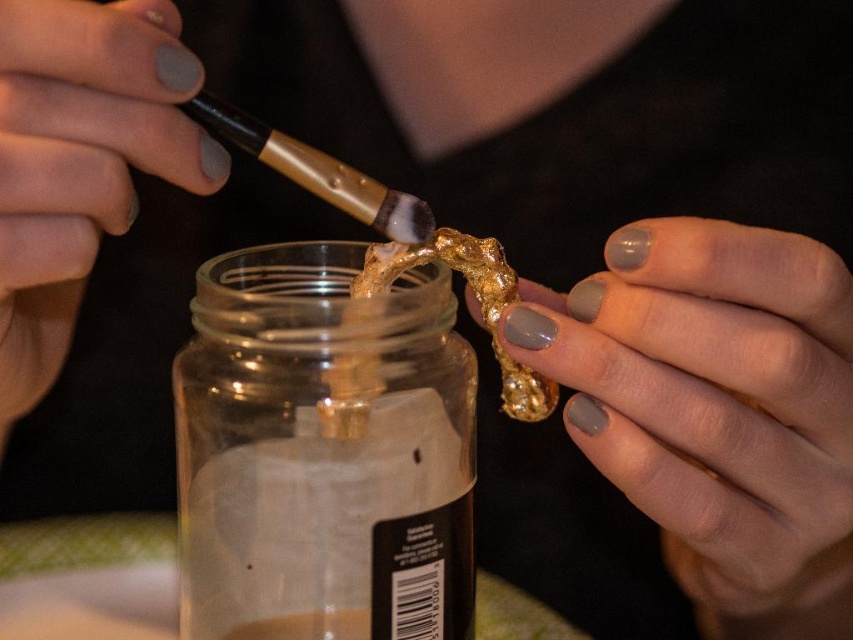
Question: Is transparent glass jar at center further to the viewer compared to matte gray nail polish at upper left?

Choices:
 (A) yes
 (B) no

Answer: (A)

Question: Can you confirm if matte gray nail polish at upper right is wider than matte gray nail polish at upper left?

Choices:
 (A) yes
 (B) no

Answer: (A)

Question: Which point is farther to the camera?

Choices:
 (A) transparent glass jar at center
 (B) matte gray nail polish at upper left

Answer: (A)

Question: Which of the following is the farthest from the observer?

Choices:
 (A) (410, 417)
 (B) (141, 77)
 (C) (492, 323)

Answer: (C)

Question: Considering the real-world distances, which object is farthest from the gold leaf at center?

Choices:
 (A) matte gray nail polish at upper left
 (B) matte gray nail polish at upper right
 (C) transparent glass jar at center

Answer: (A)

Question: Does matte gray nail polish at upper right lie in front of matte gray nail polish at upper left?

Choices:
 (A) no
 (B) yes

Answer: (A)